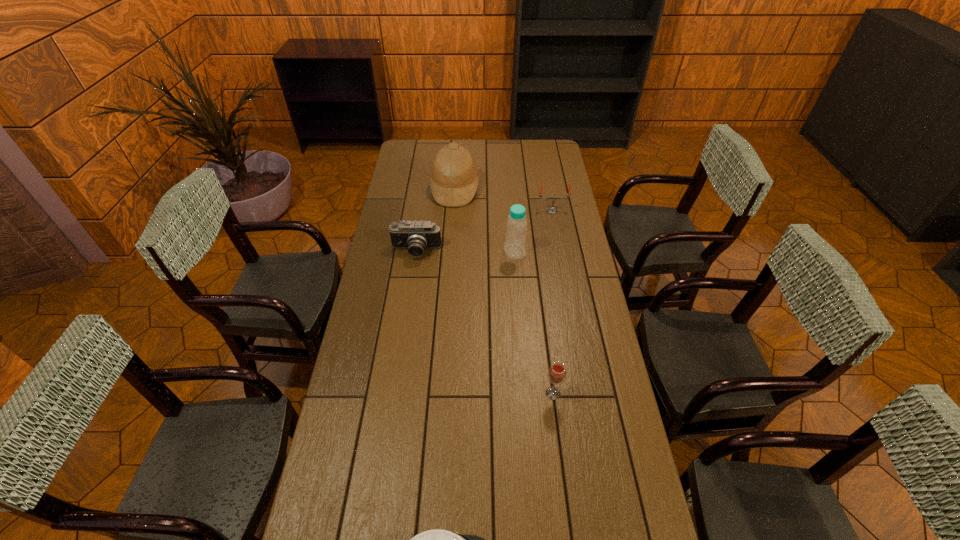
At what (x,y) coordinates should I click in order to perform the action: click on vacant space located on the front-facing side of the camera. Please return your answer as a coordinate pair (x, y). This screenshot has height=540, width=960. Looking at the image, I should click on (413, 278).

Where is `object that is at the left edge`? object that is at the left edge is located at coordinates (416, 236).

The height and width of the screenshot is (540, 960). Find the location of `object that is at the right edge`. object that is at the right edge is located at coordinates (552, 209).

Image resolution: width=960 pixels, height=540 pixels. I want to click on free spot at the left edge of the desktop, so pos(376,363).

Find the location of a particular element. free region at the right edge is located at coordinates (578, 308).

You are a GUI agent. You are given a task and a screenshot of the screen. Output one action in this format:
    pyautogui.click(x=<x>, y=<y>)
    Task: Click on the free spot at the far left corner of the desktop
    Image resolution: width=960 pixels, height=540 pixels.
    Given the screenshot: What is the action you would take?
    pyautogui.click(x=402, y=160)

Locate an element on the screen. Image resolution: width=960 pixels, height=540 pixels. free space at the far right corner of the desktop is located at coordinates [553, 151].

At what (x,y) coordinates should I click in order to perform the action: click on vacant space that is in between the camera and the rightmost object. Please return your answer as a coordinate pair (x, y). The image size is (960, 540). Looking at the image, I should click on (484, 231).

Locate an element on the screen. This screenshot has height=540, width=960. free area in between the rightmost object and the fifth farthest object is located at coordinates (553, 302).

The width and height of the screenshot is (960, 540). Identify the location of vacant point located between the fifth farthest object and the camera. (485, 322).